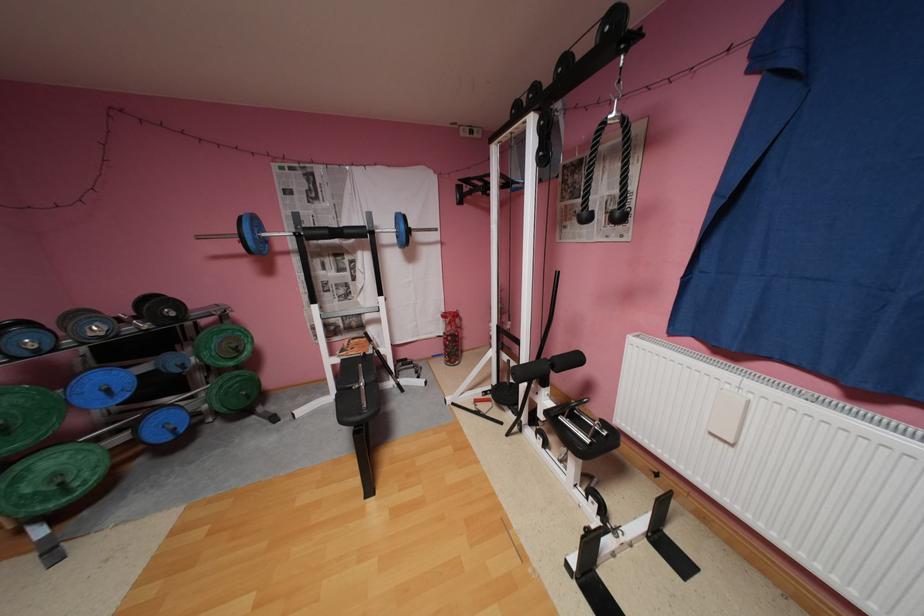
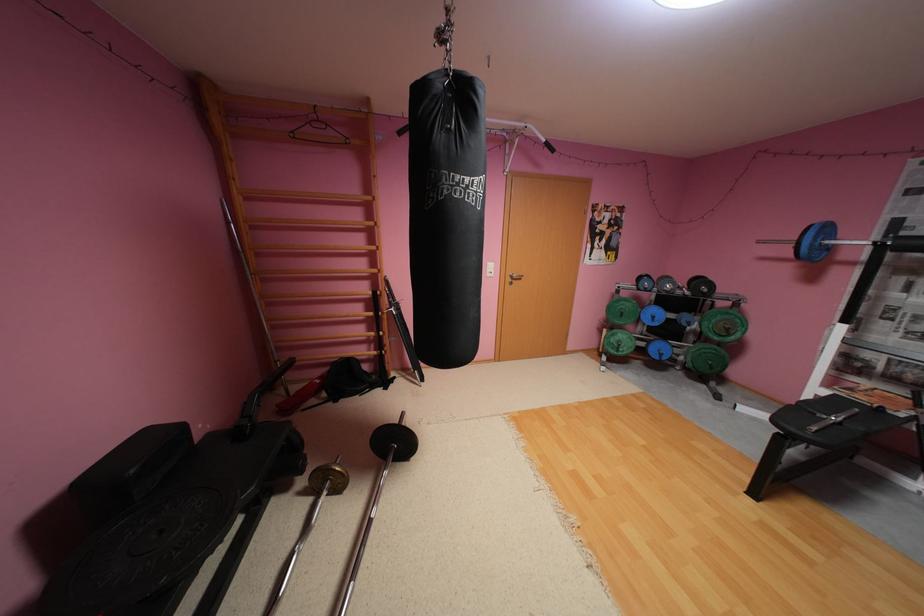
The point at (264, 222) is marked in the first image. Where is the corresponding point in the second image?

(835, 229)